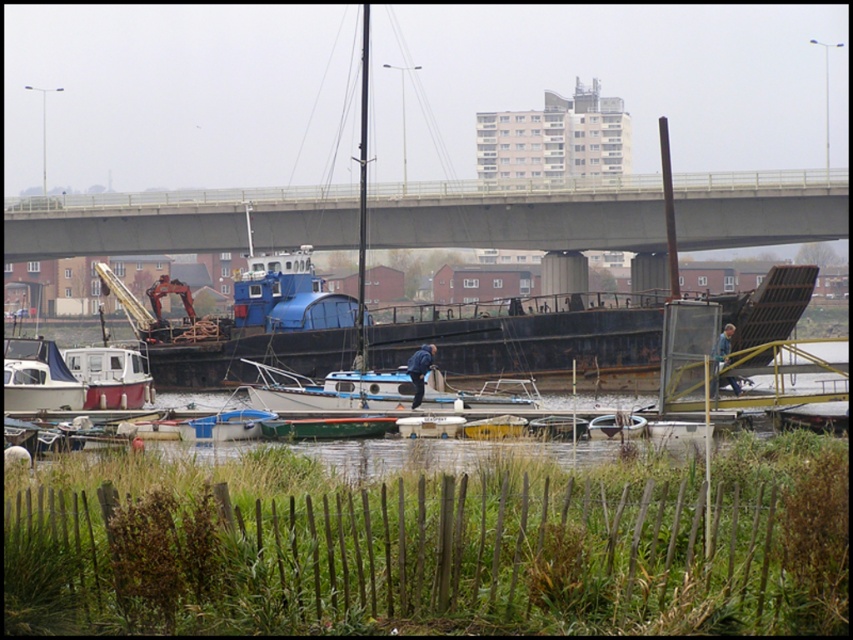
You are a photographer trying to capture the white matte sailboat at center without the gray concrete bridge at upper center blocking the view. Based on the scene, is this possible?

The white matte sailboat at center is behind the gray concrete bridge at upper center, so it is blocked by the bridge and cannot be captured without the bridge in the frame.

You are a boat operator who needs to navigate under the gray concrete bridge at upper center. What coordinates should you aim for to pass under it?

The gray concrete bridge at upper center is located at coordinates point (178, 221), so you should aim for those coordinates to navigate under it.

You are standing on the wooden fence and want to board the white matte sailboat at center. Which direction should you go relative to the white matte sailboat at lower left?

You should go downward relative to the white matte sailboat at lower left because the white matte sailboat at center is located below it.